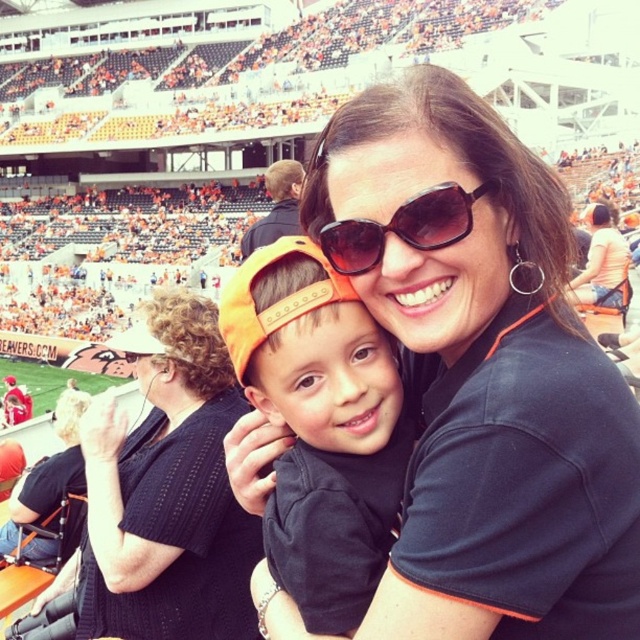
Is black fabric shirt at center positioned before orange fabric cap at center?

That is True.

Is black fabric shirt at center shorter than orange fabric cap at center?

Incorrect, black fabric shirt at center's height does not fall short of orange fabric cap at center's.

Does point (564, 616) lie in front of point (284, 252)?

Yes, it is.

Where is `black fabric shirt at center`? black fabric shirt at center is located at coordinates (483, 368).

Which is more to the right, black knit sweater at upper left or black plastic sunglasses at center?

black plastic sunglasses at center is more to the right.

Does point (154, 396) lie behind point (420, 224)?

Yes, it is.

Who is more forward, (200,616) or (486,184)?

Positioned in front is point (486,184).

In order to click on black knit sweater at upper left in this screenshot , I will do `click(170, 493)`.

Which is in front, point (428, 216) or point (433, 204)?

Point (433, 204) is more forward.

Can you confirm if black fabric shirt at center is positioned to the right of black plastic sunglasses at center?

Correct, you'll find black fabric shirt at center to the right of black plastic sunglasses at center.

Where is `black fabric shirt at center`? This screenshot has width=640, height=640. black fabric shirt at center is located at coordinates (483, 368).

Identify the location of black fabric shirt at center. (483, 368).